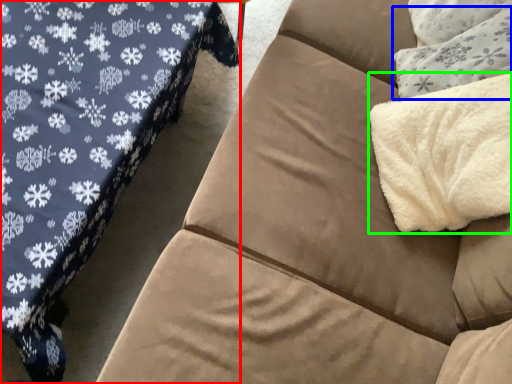
Question: Which is nearer to the studio couch (highlighted by a red box)? throw pillow (highlighted by a blue box) or blanket (highlighted by a green box).

Choices:
 (A) throw pillow
 (B) blanket

Answer: (B)